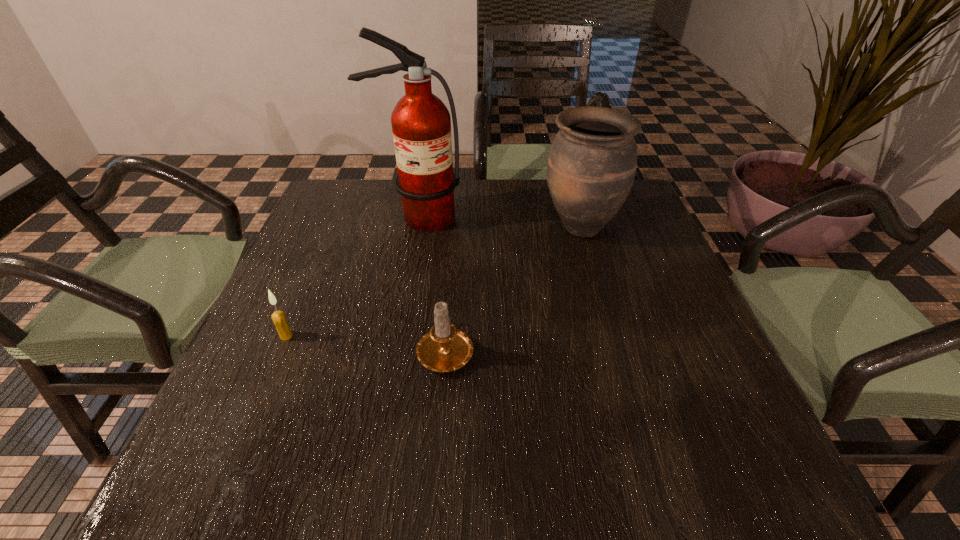
This screenshot has width=960, height=540. I want to click on free spot between the tallest object and the rightmost object, so click(499, 222).

You are a GUI agent. You are given a task and a screenshot of the screen. Output one action in this format:
    pyautogui.click(x=<x>, y=<y>)
    Task: Click on the vacant area between the right candle and the urn
    The width and height of the screenshot is (960, 540).
    Given the screenshot: What is the action you would take?
    pyautogui.click(x=513, y=288)

Where is `vacant region between the left candle and the right candle`? The width and height of the screenshot is (960, 540). vacant region between the left candle and the right candle is located at coordinates (366, 342).

At what (x,y) coordinates should I click in order to perform the action: click on vacant region between the right candle and the urn. Please return your answer as a coordinate pair (x, y). Looking at the image, I should click on (513, 288).

Locate an element on the screen. empty location between the right candle and the leftmost object is located at coordinates (366, 342).

You are a GUI agent. You are given a task and a screenshot of the screen. Output one action in this format:
    pyautogui.click(x=<x>, y=<y>)
    Task: Click on the free space between the tallest object and the right candle
    The width and height of the screenshot is (960, 540).
    Given the screenshot: What is the action you would take?
    pyautogui.click(x=432, y=283)

Where is `empty location between the fire extinguisher and the right candle`? empty location between the fire extinguisher and the right candle is located at coordinates (432, 283).

You are a GUI agent. You are given a task and a screenshot of the screen. Output one action in this format:
    pyautogui.click(x=<x>, y=<y>)
    Task: Click on the free space that is in between the right candle and the tallest object
    The height and width of the screenshot is (540, 960).
    Given the screenshot: What is the action you would take?
    pyautogui.click(x=432, y=283)

At what (x,y) coordinates should I click in order to perform the action: click on unoccupied area between the right candle and the fire extinguisher. Please return your answer as a coordinate pair (x, y). Image resolution: width=960 pixels, height=540 pixels. Looking at the image, I should click on (432, 283).

At what (x,y) coordinates should I click in order to perform the action: click on free space between the right candle and the leftmost object. Please return your answer as a coordinate pair (x, y). Looking at the image, I should click on (366, 342).